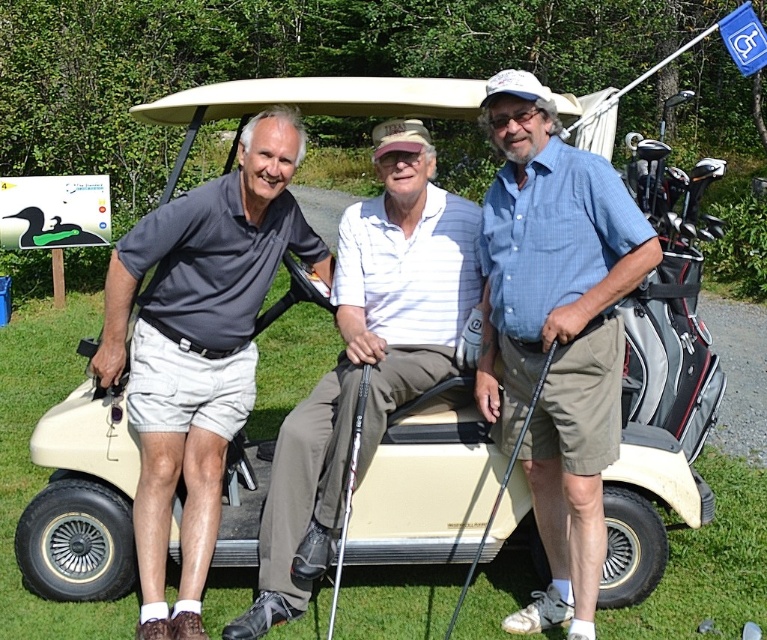
Looking at the group of men beside the golf cart, which object is wider between the white striped polo shirt at center and the silver metallic golf club at center?

The white striped polo shirt at center is wider than the silver metallic golf club at center according to the description.

You are a photographer trying to capture a clear shot of the white striped polo shirt at center and the silver metallic golf club at center. Based on their positions, which one is closer to the camera?

The white striped polo shirt at center is located above the silver metallic golf club at center, so it is closer to the camera.

You are a photographer trying to capture a clear shot of the blue plaid shirt at center and the white striped polo shirt at center. Which one is closer to the camera?

The blue plaid shirt at center is positioned over the white striped polo shirt at center, so it is closer to the camera.